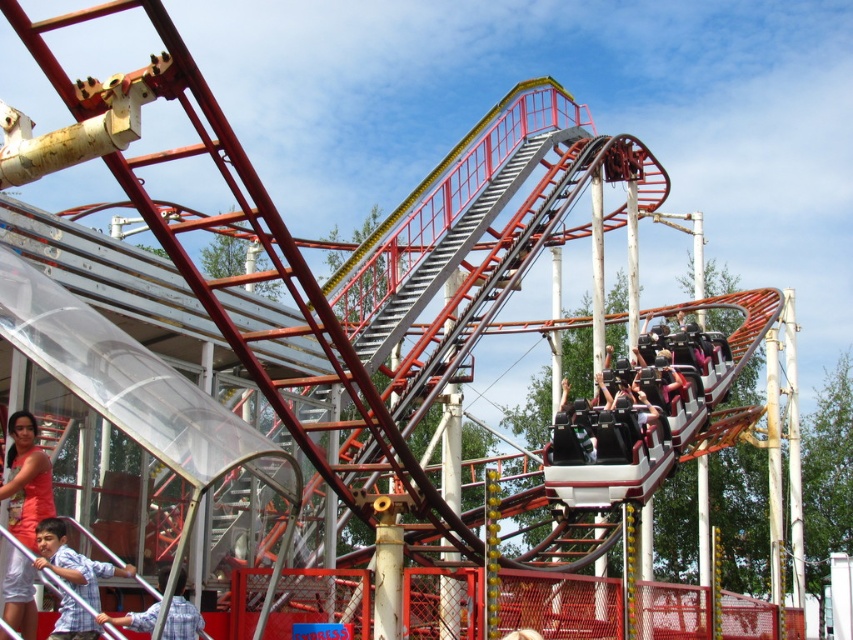
You are a photographer standing at the entrance of the amusement park and want to take a photo of the riders on the roller coaster. You notice two people in the lower left corner of your viewfinder wearing a light blue shirt at lower left and a blue plaid shirt at lower left. Which one is closer to you?

The light blue shirt at lower left is closer to you because the blue plaid shirt at lower left is behind it.

Consider the image. You are standing at the entrance of the amusement park and see the smooth brown roller coaster at center and the light blue shirt at lower left. Which object is positioned more to the right from your perspective?

The smooth brown roller coaster at center is positioned to the right of the light blue shirt at lower left, so it is more to the right.